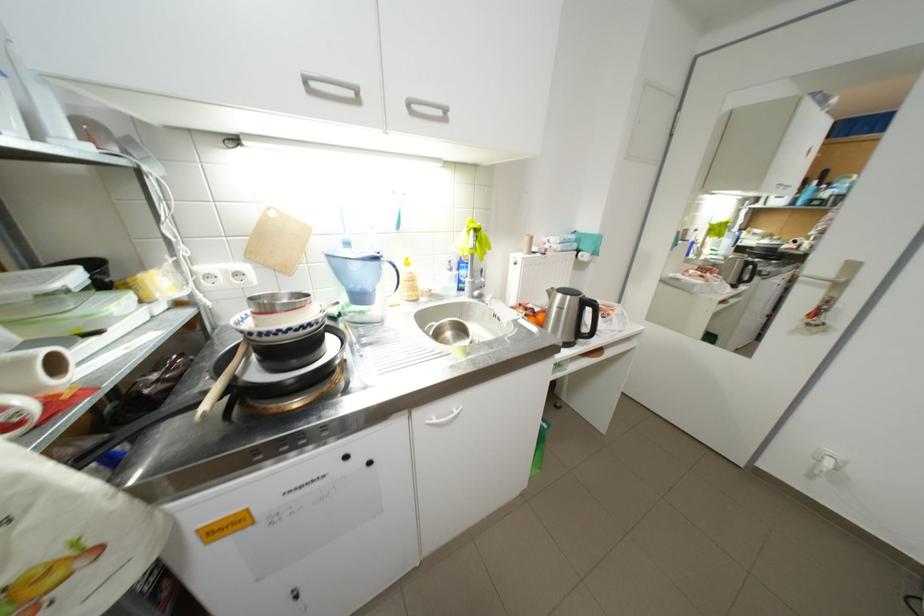
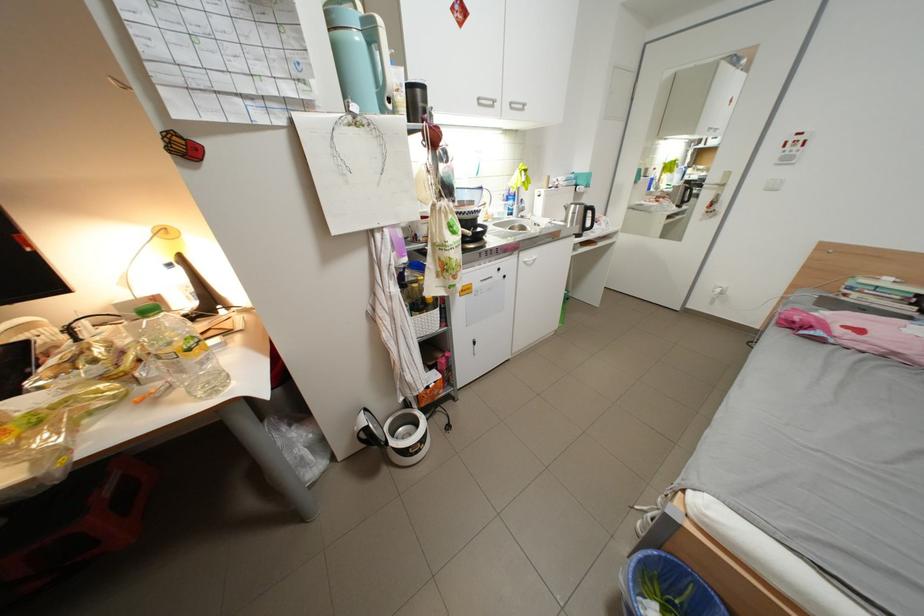
The point at (420, 105) is marked in the first image. Where is the corresponding point in the second image?

(523, 105)